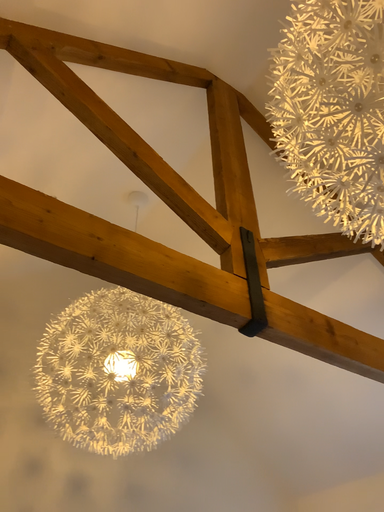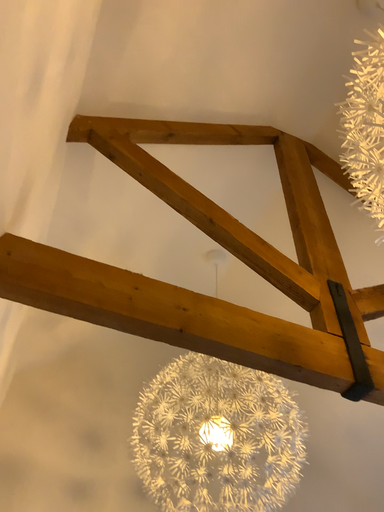
Question: How did the camera likely rotate when shooting the video?

Choices:
 (A) rotated right
 (B) rotated left

Answer: (B)